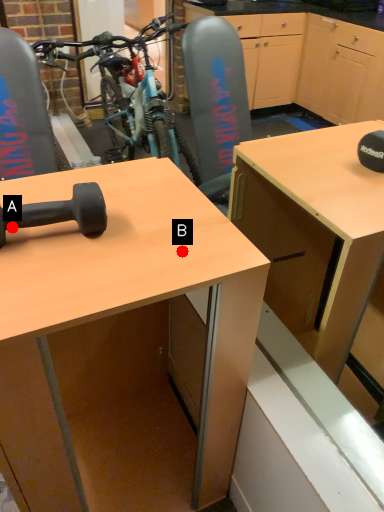
Question: Two points are circled on the image, labeled by A and B beside each circle. Which point appears closest to the camera in this image?

Choices:
 (A) A is closer
 (B) B is closer

Answer: (B)